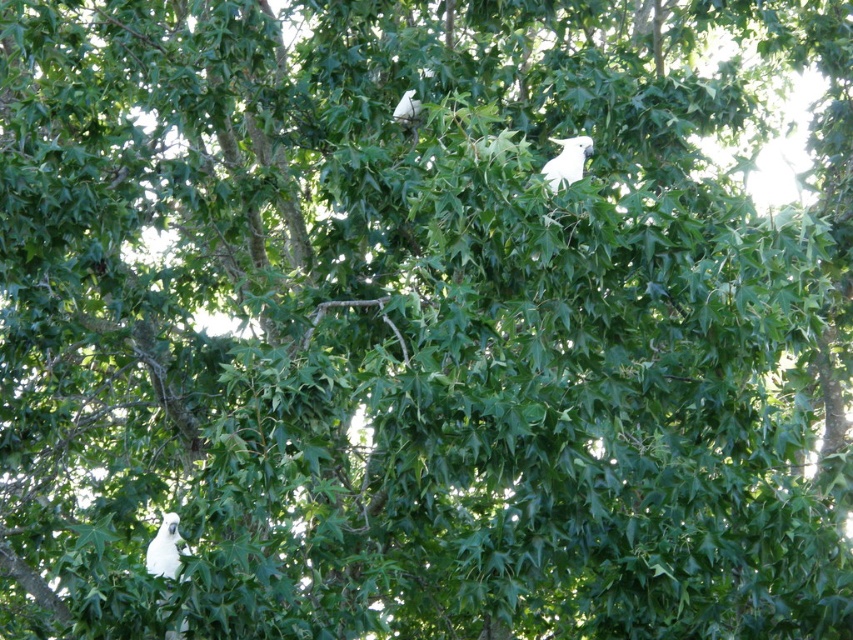
You are a birdwatcher observing the tree. You notice two white feathered birds in the tree. Which one has a larger width between the white feathered bird at upper right and the white feathered bird at upper center?

The white feathered bird at upper right has a larger width than the white feathered bird at upper center.